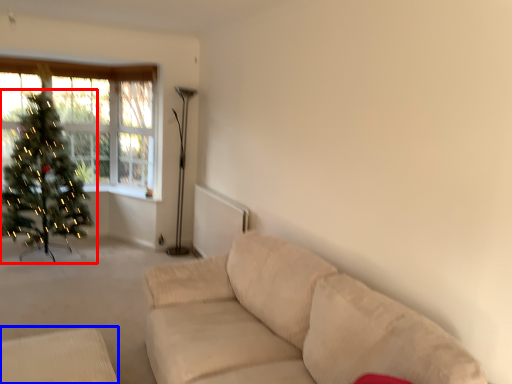
Question: Which object appears closest to the camera in this image, christmas tree (highlighted by a red box) or furniture (highlighted by a blue box)?

Choices:
 (A) christmas tree
 (B) furniture

Answer: (B)